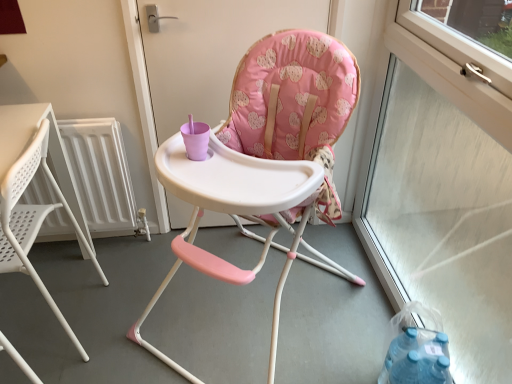
At what (x,y) coordinates should I click in order to perform the action: click on empty space that is in between pink fabric high chair at center and white plastic chair at left, acting as the 2th chair starting from the right. Please return your answer as a coordinate pair (x, y). Looking at the image, I should click on (156, 279).